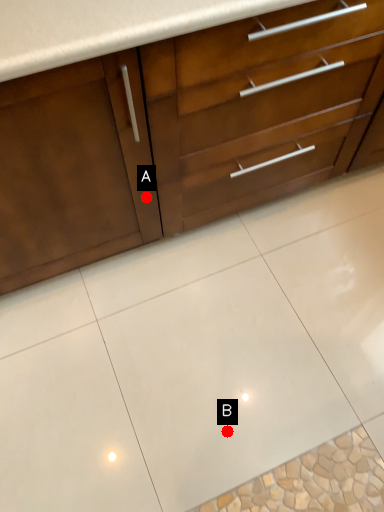
Question: Two points are circled on the image, labeled by A and B beside each circle. Among these points, which one is nearest to the camera?

Choices:
 (A) A is closer
 (B) B is closer

Answer: (B)